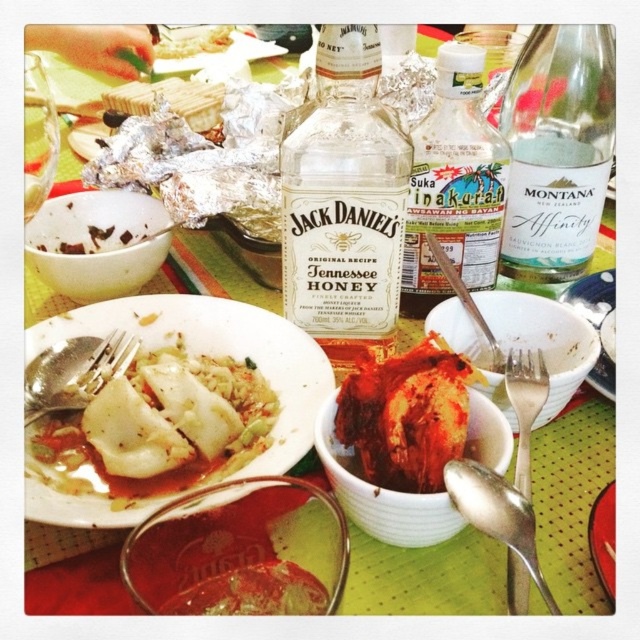
Measure the distance between translucent glass bowl at center and translucent plastic bottle at center.

translucent glass bowl at center is 8.62 inches away from translucent plastic bottle at center.

Is point (212, 554) in front of point (451, 196)?

Yes, point (212, 554) is in front of point (451, 196).

Find the location of a particular element. translucent glass bowl at center is located at coordinates (241, 552).

Which is above, silver metallic fork at lower right or chocolatesmoothbowl at center?

Positioned higher is chocolatesmoothbowl at center.

Looking at this image, who is positioned more to the left, silver metallic fork at lower right or chocolatesmoothbowl at center?

chocolatesmoothbowl at center

Locate an element on the screen. Image resolution: width=640 pixels, height=640 pixels. silver metallic fork at lower right is located at coordinates (524, 404).

Find the location of `silver metallic fork at lower right`. silver metallic fork at lower right is located at coordinates (524, 404).

This screenshot has height=640, width=640. What do you see at coordinates (557, 150) in the screenshot? I see `clear glass bottle at upper right` at bounding box center [557, 150].

Which of these two, clear glass bottle at upper right or white matte plate at center, stands taller?

clear glass bottle at upper right

Does point (570, 124) come behind point (589, 292)?

No.

At what (x,y) coordinates should I click in order to perform the action: click on clear glass bottle at upper right. Please return your answer as a coordinate pair (x, y). This screenshot has width=640, height=640. Looking at the image, I should click on (557, 150).